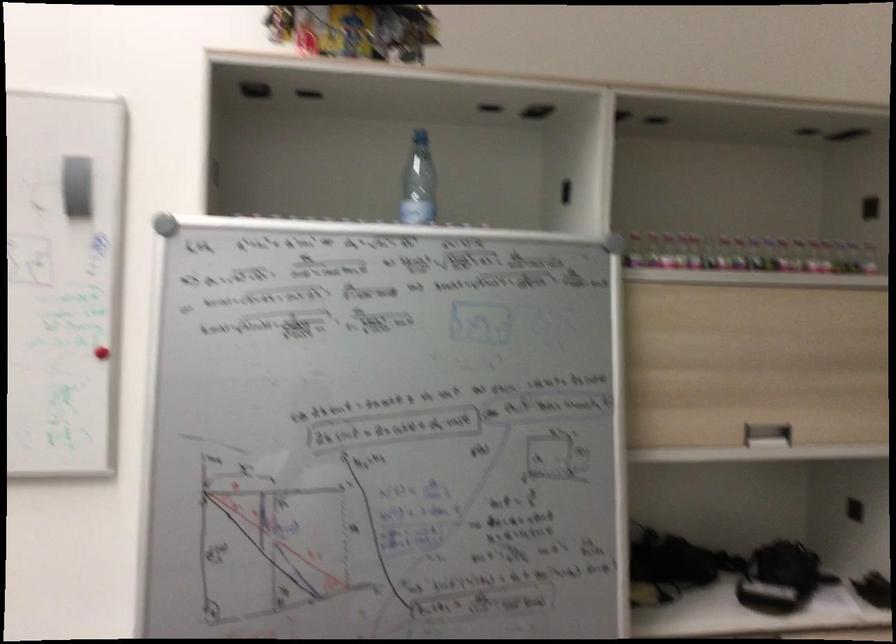
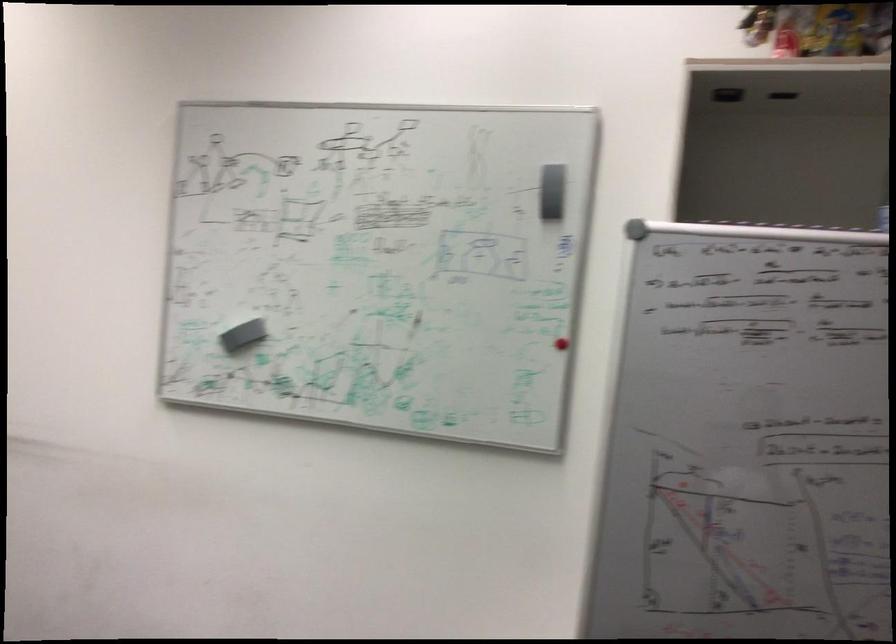
Locate, in the second image, the point that corresponds to pixel 93 191 in the first image.

(554, 191)